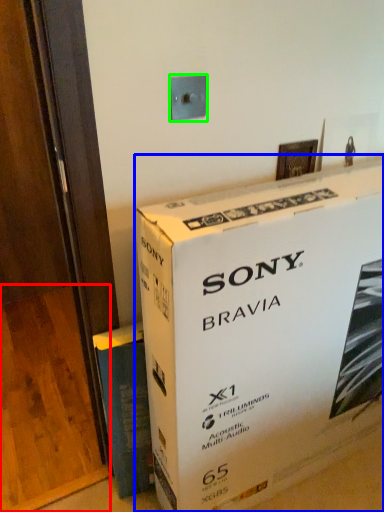
Question: Estimate the real-world distances between objects in this image. Which object is farther from plywood (highlighted by a red box), box (highlighted by a blue box) or electric outlet (highlighted by a green box)?

Choices:
 (A) box
 (B) electric outlet

Answer: (B)